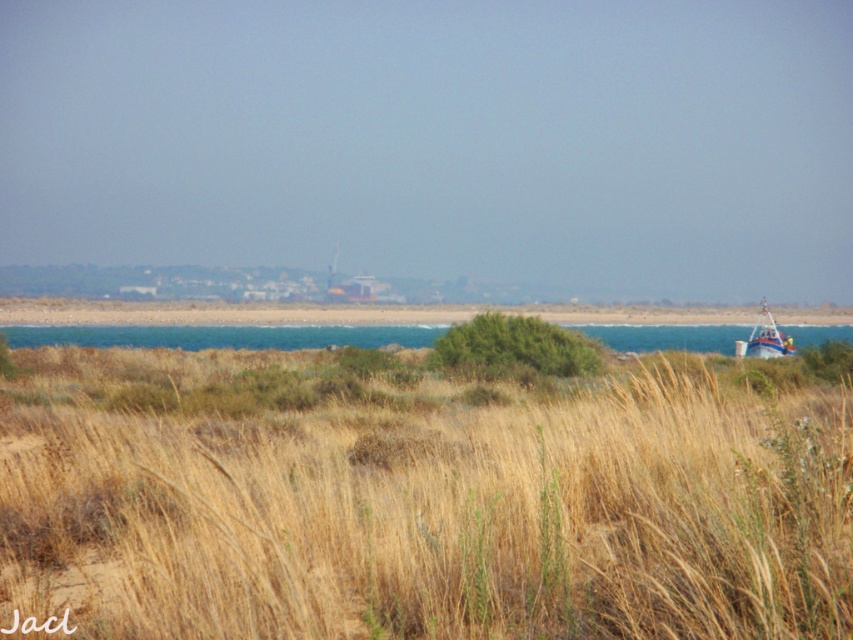
Measure the distance from dry grass at center to blue water at lower right.

dry grass at center is 130.23 feet from blue water at lower right.

Can you confirm if dry grass at center is positioned to the left of blue water at lower right?

Yes, dry grass at center is to the left of blue water at lower right.

This screenshot has height=640, width=853. I want to click on dry grass at center, so click(x=416, y=502).

At what (x,y) coordinates should I click in order to perform the action: click on dry grass at center. Please return your answer as a coordinate pair (x, y). Looking at the image, I should click on (416, 502).

Can you confirm if blue water at lower right is positioned to the right of white plastic boat at right?

Incorrect, blue water at lower right is not on the right side of white plastic boat at right.

Is point (648, 330) positioned in front of point (761, 332)?

No, it is not.

This screenshot has width=853, height=640. I want to click on blue water at lower right, so click(221, 336).

Does dry grass at center have a greater width compared to white plastic boat at right?

Yes, dry grass at center is wider than white plastic boat at right.

Can you confirm if dry grass at center is bigger than white plastic boat at right?

No, dry grass at center is not bigger than white plastic boat at right.

Who is more distant from viewer, (769, 552) or (753, 332)?

The point (753, 332) is behind.

This screenshot has width=853, height=640. What are the coordinates of `dry grass at center` in the screenshot? It's located at (416, 502).